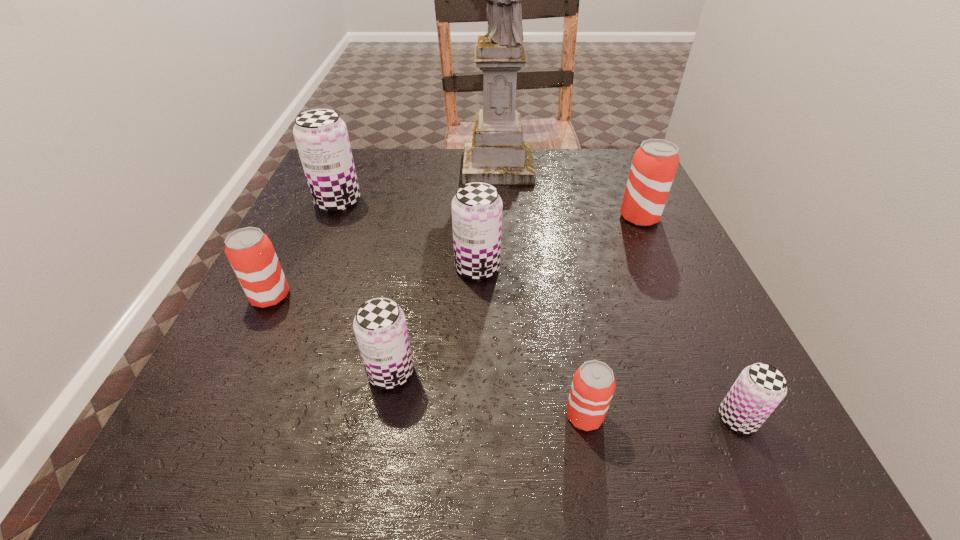
You are a GUI agent. You are given a task and a screenshot of the screen. Output one action in this format:
    pyautogui.click(x=<x>, y=<y>)
    Task: Click on the third closest purple beer can to the rightmost orange beer can
    
    Given the screenshot: What is the action you would take?
    pyautogui.click(x=380, y=327)

Select which purple beer can is the third closest to the second tallest object. Please provide its 2D coordinates. Your answer should be formatted as a tuple, i.e. [(x, y)], where the tuple contains the x and y coordinates of a point satisfying the conditions above.

[(759, 389)]

This screenshot has height=540, width=960. What are the coordinates of `the second closest orange beer can to the nearest purple beer can` in the screenshot? It's located at (654, 165).

This screenshot has width=960, height=540. Identify the location of the second closest orange beer can to the farthest object. (250, 252).

Where is `vacant space that satisfies the following two spatial constraints: 1. on the front-facing side of the sculpture; 2. on the back side of the nearest purple beer can`? The image size is (960, 540). vacant space that satisfies the following two spatial constraints: 1. on the front-facing side of the sculpture; 2. on the back side of the nearest purple beer can is located at coordinates (513, 418).

What are the coordinates of `free space that satisfies the following two spatial constraints: 1. on the front-facing side of the nearest purple beer can; 2. on the right side of the gray sculpture` in the screenshot? It's located at coord(513,418).

At what (x,y) coordinates should I click in order to perform the action: click on free space that satisfies the following two spatial constraints: 1. on the front side of the smallest purple beer can; 2. on the left side of the leftmost purple beer can. Please return your answer as a coordinate pair (x, y). The image size is (960, 540). Looking at the image, I should click on (247, 418).

Locate an element on the screen. free spot that satisfies the following two spatial constraints: 1. on the back side of the leftmost orange beer can; 2. on the right side of the biggest purple beer can is located at coordinates (316, 201).